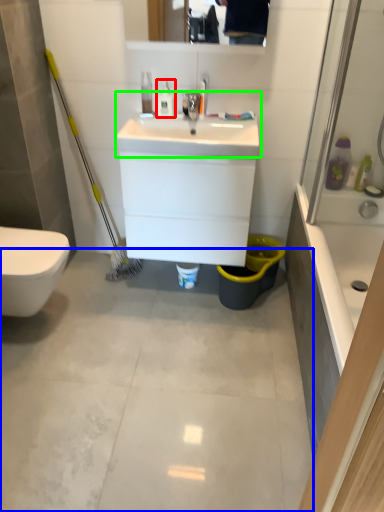
Question: Considering the real-world distances, which object is farthest from toiletry (highlighted by a red box)? concrete (highlighted by a blue box) or sink (highlighted by a green box)?

Choices:
 (A) concrete
 (B) sink

Answer: (A)